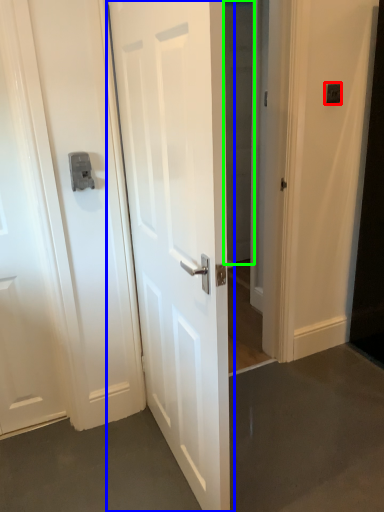
Question: Considering the real-world distances, which object is farthest from light switch (highlighted by a red box)? door (highlighted by a blue box) or glass door (highlighted by a green box)?

Choices:
 (A) door
 (B) glass door

Answer: (A)